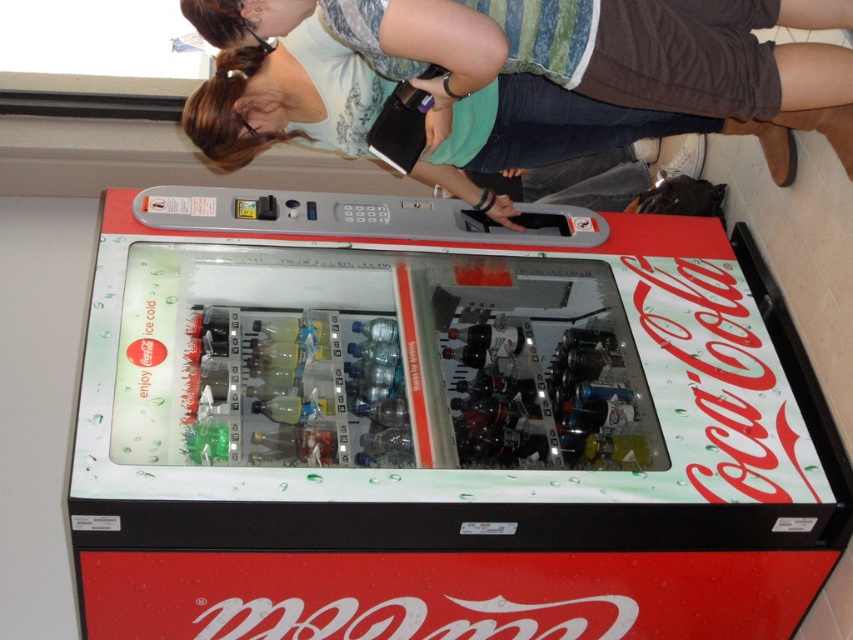
In the scene shown: Is metallic silver vending machine at center wider than matte green shirt at upper center?

Correct, the width of metallic silver vending machine at center exceeds that of matte green shirt at upper center.

Locate an element on the screen. Image resolution: width=853 pixels, height=640 pixels. metallic silver vending machine at center is located at coordinates pyautogui.click(x=445, y=436).

Who is more forward, (605, 436) or (248, 45)?

Point (248, 45)

The width and height of the screenshot is (853, 640). I want to click on metallic silver vending machine at center, so click(x=445, y=436).